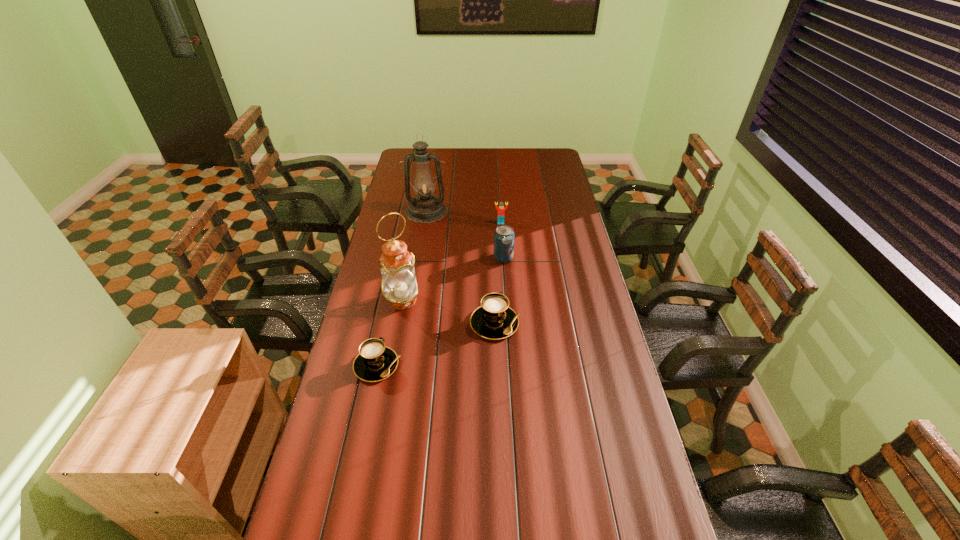
I want to click on the shortest object, so click(x=375, y=362).

Where is `the left cappuccino`? the left cappuccino is located at coordinates (375, 362).

Where is `the right cappuccino`? the right cappuccino is located at coordinates (494, 319).

I want to click on the taller cappuccino, so click(x=494, y=319).

Where is `Lego`? Lego is located at coordinates (501, 210).

Where is `the farther oil lamp`? The width and height of the screenshot is (960, 540). the farther oil lamp is located at coordinates (426, 207).

Locate an element on the screen. The width and height of the screenshot is (960, 540). the third tallest object is located at coordinates (504, 236).

At what (x,y) coordinates should I click in order to perform the action: click on pop soda. Please return your answer as a coordinate pair (x, y). The image size is (960, 540). Looking at the image, I should click on (504, 236).

Identify the location of the nearer oil lamp. The width and height of the screenshot is (960, 540). (399, 286).

Locate an element on the screen. This screenshot has width=960, height=540. free location located on the front of the nearest object is located at coordinates (360, 444).